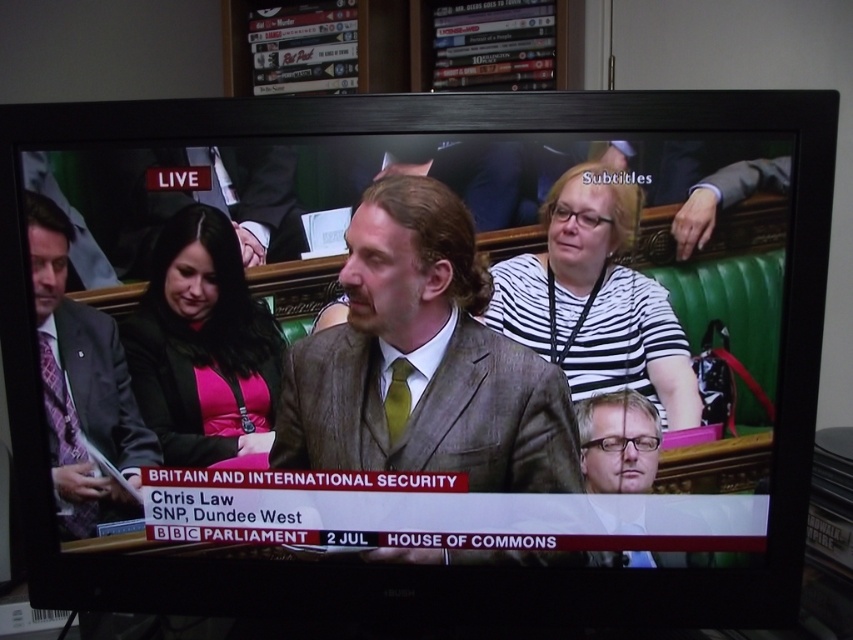
You are a camera operator adjusting the focus on the TV screen. There are two points marked on the screen at coordinates point (392,353) and point (215,241). Which point is closer to the camera?

Point (215,241) is closer to the camera because the description states that point (392,353) is behind point (215,241).

You are a fashion designer observing the live broadcast on the TV screen. You notice two fabrics at the center of the image. Which fabric is larger in size between the striped fabric shirt at center and the pink fabric at center?

The striped fabric shirt at center has a smaller size compared to pink fabric at center, so the pink fabric at center is larger in size.